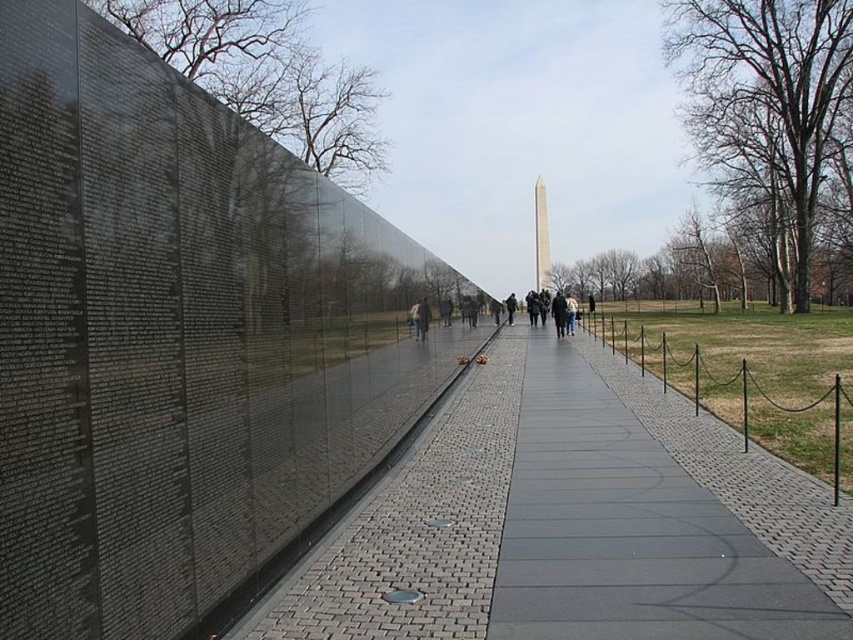
You are standing at the memorial and want to place a small bouquet of flowers on the shorter object between the gray concrete sidewalk at center and the polished marble obelisk at center. Which object should you place the flowers on?

The gray concrete sidewalk at center is shorter than the polished marble obelisk at center, so you should place the flowers on the gray concrete sidewalk at center.

You are standing at the memorial and want to reach the gray concrete sidewalk at center. According to the coordinates provided, what are the exact coordinates you need to move towards?

The gray concrete sidewalk at center is located at coordinates point (573, 522).